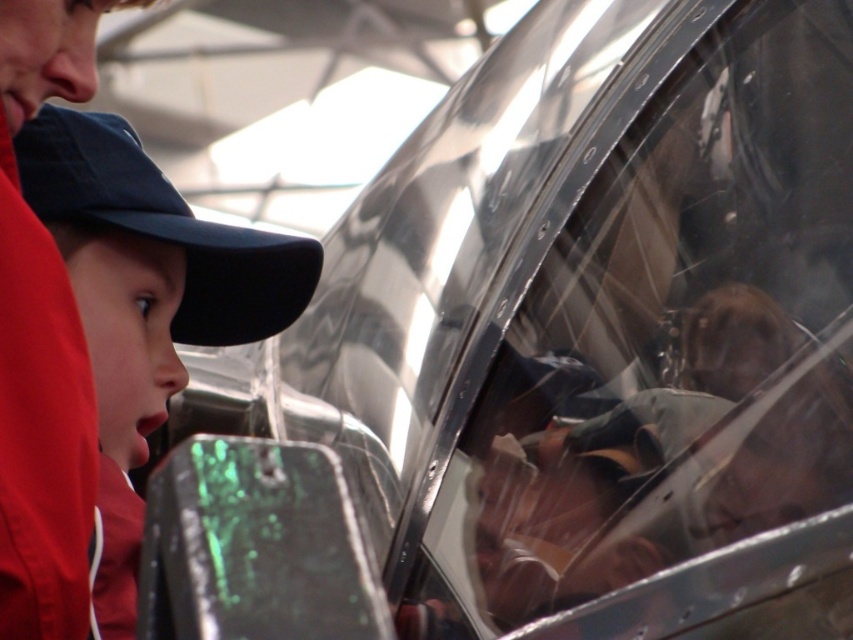
Question: Which point appears closest to the camera in this image?

Choices:
 (A) (64, 148)
 (B) (80, 76)
 (C) (6, 195)

Answer: (C)

Question: Is matte black cap at left positioned at the back of matte skin nose at upper left?

Choices:
 (A) yes
 (B) no

Answer: (B)

Question: Which point is closer to the camera?

Choices:
 (A) matte black nose at left
 (B) matte skin nose at upper left
 (C) dark blue fabric baseball cap at left

Answer: (B)

Question: Can you confirm if matte black cap at left is wider than matte skin nose at upper left?

Choices:
 (A) yes
 (B) no

Answer: (A)

Question: Which point is closer to the camera?

Choices:
 (A) (9, 342)
 (B) (62, 76)
 (C) (16, 157)

Answer: (A)

Question: Does matte black helmet at center have a greater width compared to matte black nose at left?

Choices:
 (A) no
 (B) yes

Answer: (B)